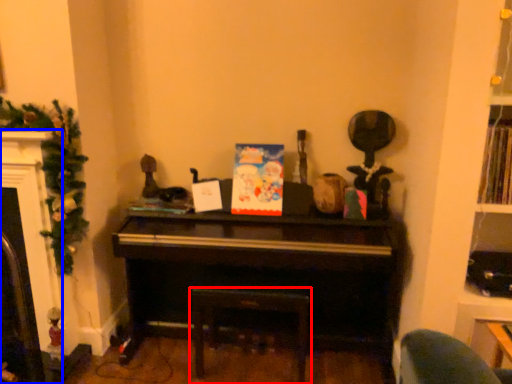
Question: Which object appears closest to the camera in this image, furniture (highlighted by a red box) or fireplace (highlighted by a blue box)?

Choices:
 (A) furniture
 (B) fireplace

Answer: (B)